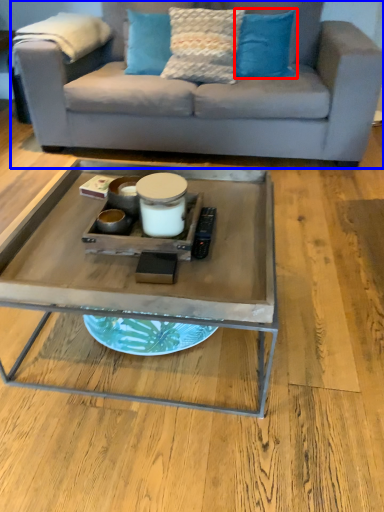
Question: Which of the following is the closest to the observer, pillow (highlighted by a red box) or studio couch (highlighted by a blue box)?

Choices:
 (A) pillow
 (B) studio couch

Answer: (B)